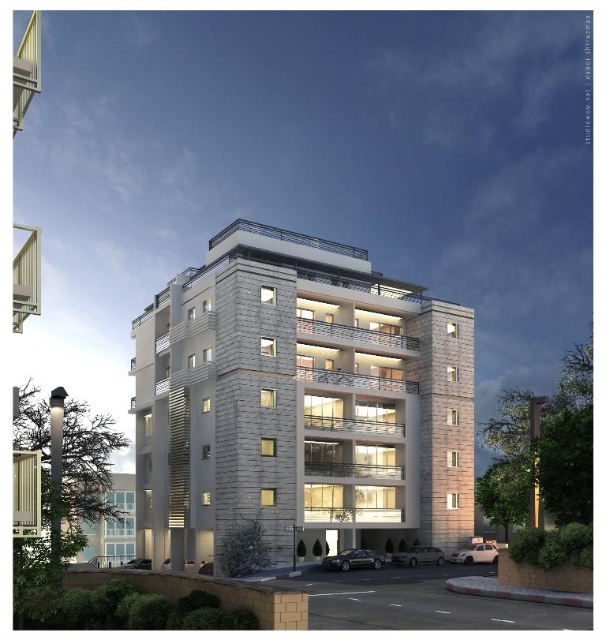
You are standing on the sidewalk in front of the white stone building at center and the white stone building at lower left. Which building appears higher in the image?

The white stone building at center appears higher than the white stone building at lower left because it is positioned above it in the image.

You are standing at a viewpoint where you can see both the white stone building at center and the white stone building at lower left. If you want to visit the closer one first, which building should you head towards?

The white stone building at lower left is closer to your current position, so you should head towards the white stone building at lower left first.